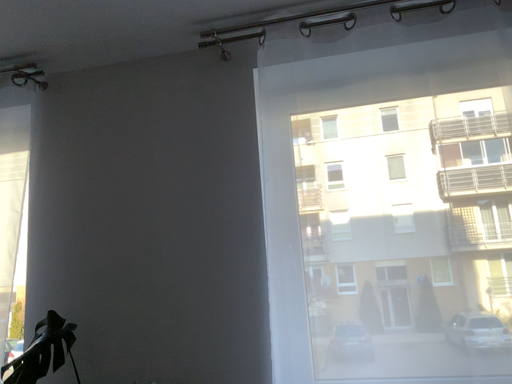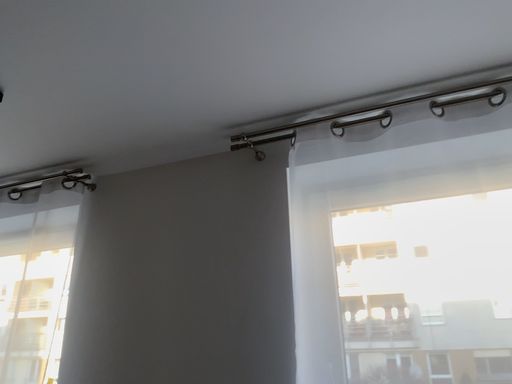
Question: How did the camera likely rotate when shooting the video?

Choices:
 (A) rotated downward
 (B) rotated upward

Answer: (B)